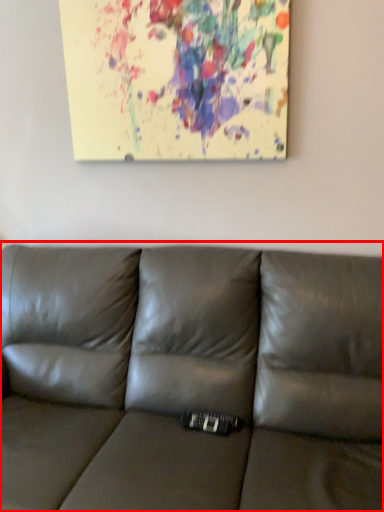
Question: Observing the image, what is the correct spatial positioning of studio couch (annotated by the red box) in reference to oil painting?

Choices:
 (A) left
 (B) right

Answer: (A)